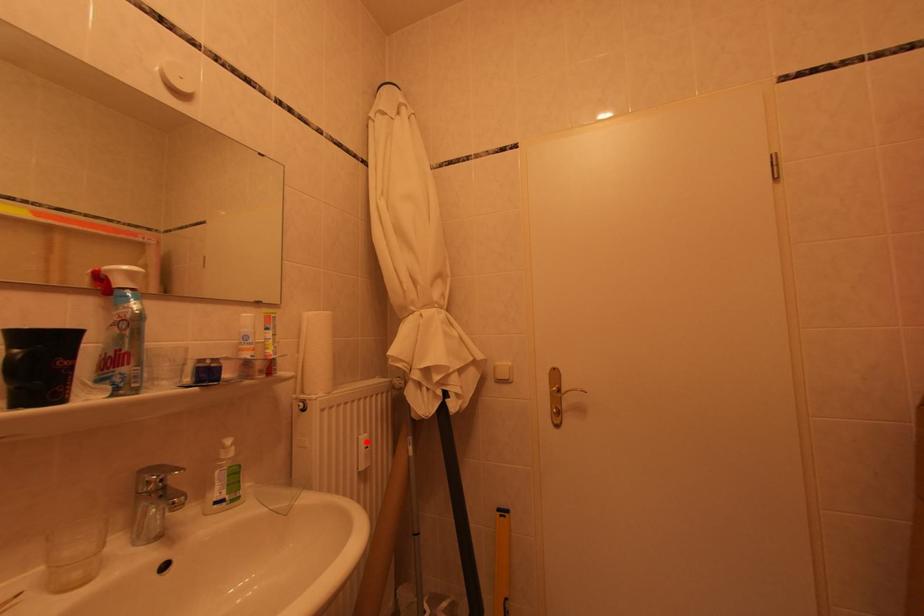
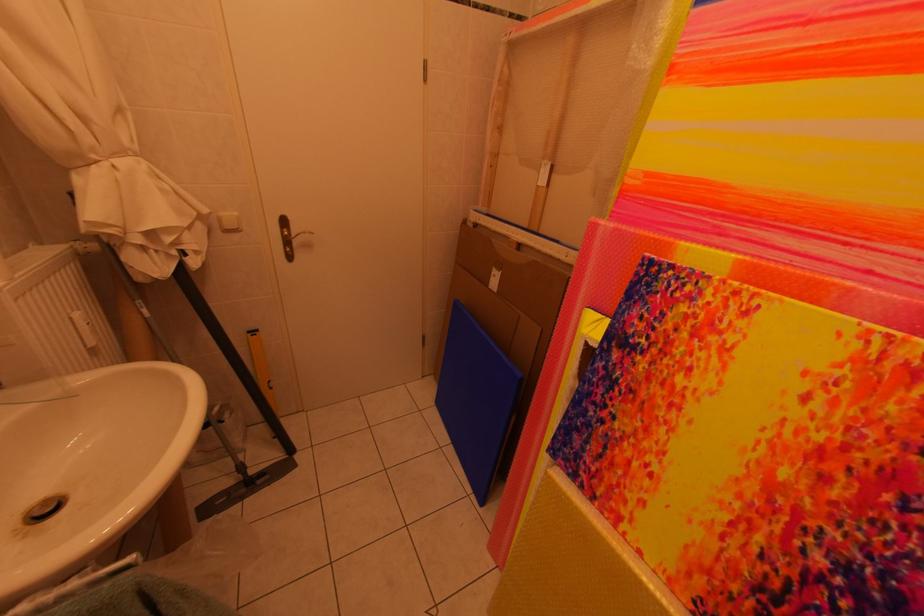
Locate, in the second image, the point that corresponds to the highlighted location in the first image.

(79, 321)